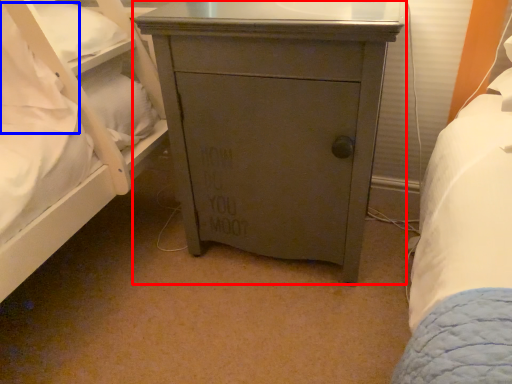
Question: Which object is further to the camera taking this photo, chest of drawers (highlighted by a red box) or pillow (highlighted by a blue box)?

Choices:
 (A) chest of drawers
 (B) pillow

Answer: (B)